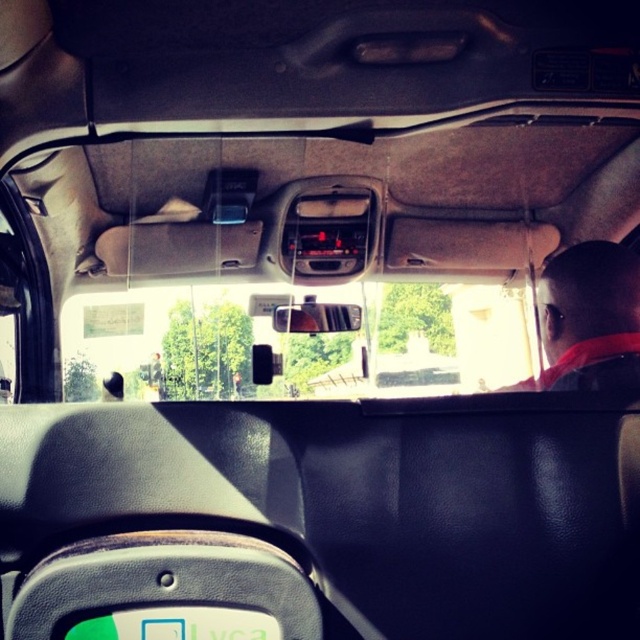
You are a passenger in the car and want to check the license plate number but the clear plastic view mirror at center is blocking your view. Can you move the mirror to see the green matte license plate at lower center?

The green matte license plate at lower center is in front of the clear plastic view mirror at center, so moving the mirror might allow you to see the license plate by adjusting its position.

You are a passenger in the backseat of a car and need to locate both the dark gray fabric headrest at right and the green matte license plate at lower center. Which object is positioned higher from the ground?

The dark gray fabric headrest at right is located above the green matte license plate at lower center, so it is higher from the ground.

You are sitting in the backseat of the vehicle and notice the dark gray fabric headrest at right. Where exactly is this headrest positioned relative to the dashboard and rearview mirror?

The dark gray fabric headrest at right is located at point coordinates approximately 0.484 along the horizontal axis and 0.916 along the vertical axis, placing it near the right side of the dashboard and slightly below the rearview mirror.